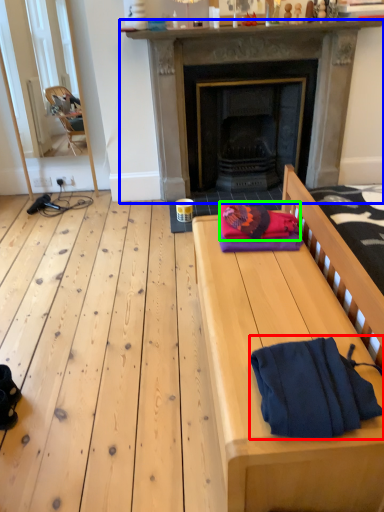
Question: Based on their relative distances, which object is farther from bath towel (highlighted by a red box)? Choose from fireplace (highlighted by a blue box) and blanket (highlighted by a green box).

Choices:
 (A) fireplace
 (B) blanket

Answer: (A)